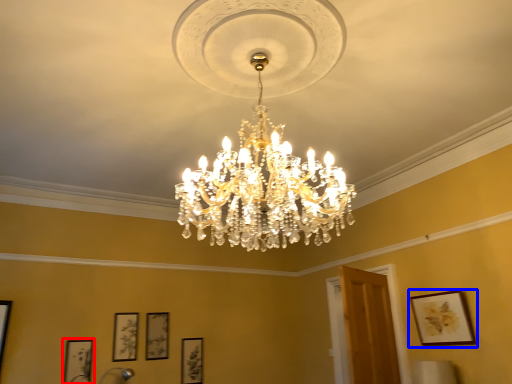
Question: Which of the following is the farthest to the observer, picture frame (highlighted by a red box) or picture frame (highlighted by a blue box)?

Choices:
 (A) picture frame
 (B) picture frame

Answer: (A)